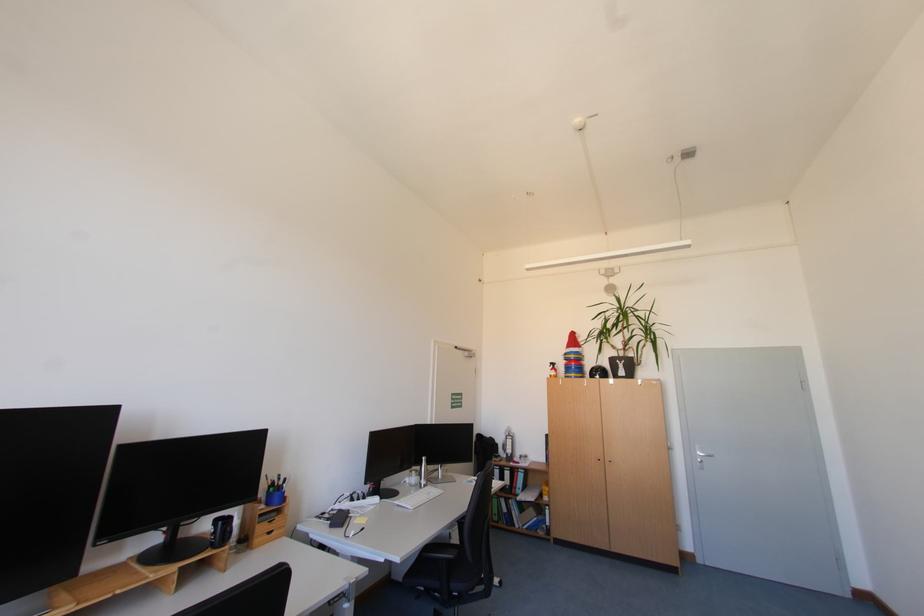
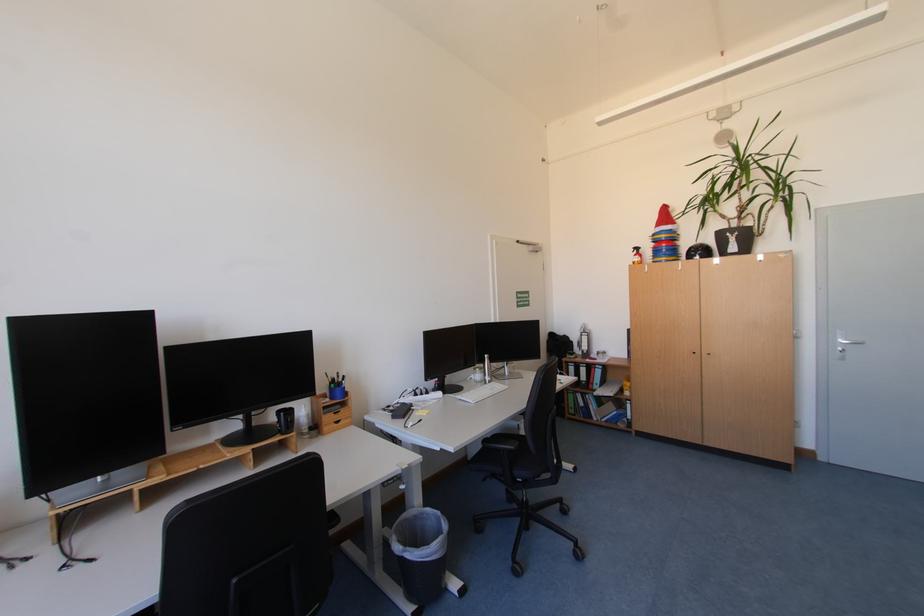
In the second image, find the point that corresponds to (248,546) in the first image.

(321, 432)